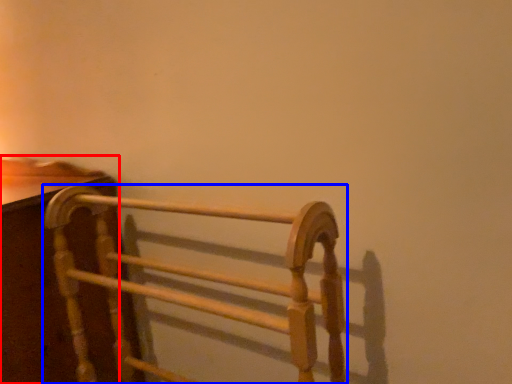
Question: Which object appears farthest to the camera in this image, furniture (highlighted by a red box) or furniture (highlighted by a blue box)?

Choices:
 (A) furniture
 (B) furniture

Answer: (A)